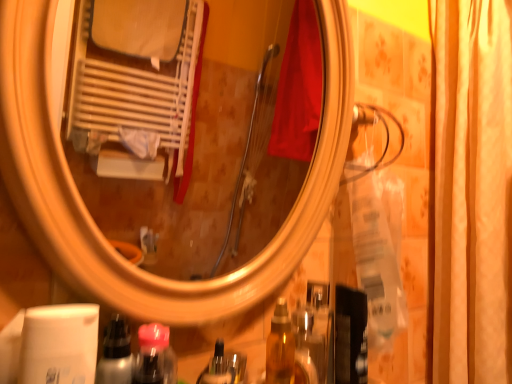
Question: Can you confirm if translucent plastic bottle at lower center is smaller than metallic silver spray at lower left?

Choices:
 (A) no
 (B) yes

Answer: (B)

Question: Is translucent plastic bottle at lower center aimed at metallic silver spray at lower left?

Choices:
 (A) yes
 (B) no

Answer: (B)

Question: Is translucent plastic bottle at lower center taller than metallic silver spray at lower left?

Choices:
 (A) no
 (B) yes

Answer: (A)

Question: From the image's perspective, would you say translucent plastic bottle at lower center is shown under metallic silver spray at lower left?

Choices:
 (A) no
 (B) yes

Answer: (B)

Question: Is the position of translucent plastic bottle at lower center more distant than that of metallic silver spray at lower left?

Choices:
 (A) no
 (B) yes

Answer: (B)

Question: From a real-world perspective, is translucent plastic bottle at lower center under metallic silver spray at lower left?

Choices:
 (A) no
 (B) yes

Answer: (B)

Question: Is translucent plastic bottle at lower center facing away from silky beige curtain at right?

Choices:
 (A) yes
 (B) no

Answer: (B)

Question: Considering the relative sizes of translucent plastic bottle at lower center and silky beige curtain at right in the image provided, is translucent plastic bottle at lower center bigger than silky beige curtain at right?

Choices:
 (A) yes
 (B) no

Answer: (B)

Question: Can you confirm if translucent plastic bottle at lower center is thinner than silky beige curtain at right?

Choices:
 (A) yes
 (B) no

Answer: (A)

Question: Is translucent plastic bottle at lower center not inside silky beige curtain at right?

Choices:
 (A) no
 (B) yes

Answer: (B)

Question: Is translucent plastic bottle at lower center to the left of silky beige curtain at right from the viewer's perspective?

Choices:
 (A) no
 (B) yes

Answer: (B)

Question: Is the surface of translucent plastic bottle at lower center in direct contact with silky beige curtain at right?

Choices:
 (A) no
 (B) yes

Answer: (A)

Question: From the image's perspective, does silky beige curtain at right appear lower than metallic silver spray at lower left?

Choices:
 (A) yes
 (B) no

Answer: (B)